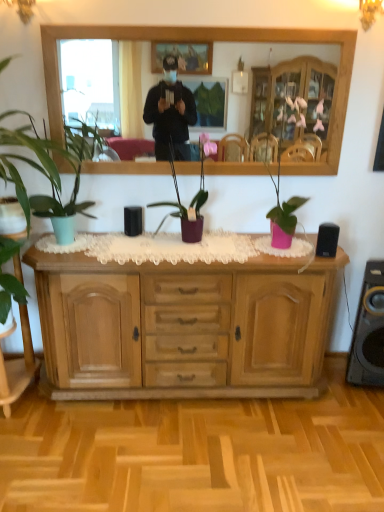
You are a GUI agent. You are given a task and a screenshot of the screen. Output one action in this format:
    pyautogui.click(x=<x>, y=<y>)
    Task: Click on the matte green plant at left, the 2th houseplant in the left-to-right sequence
    This screenshot has width=384, height=512.
    Given the screenshot: What is the action you would take?
    pyautogui.click(x=46, y=168)

What is the approximate width of black matte speaker at right?

10.34 centimeters.

Locate an element on the screen. This screenshot has width=384, height=512. matte purple pot at center, which is the 1th houseplant from right to left is located at coordinates (191, 200).

The height and width of the screenshot is (512, 384). Find the location of `light brown wood cabinet at center`. light brown wood cabinet at center is located at coordinates (183, 327).

From the image's perspective, starting from the matte purple pot at center, which is the 1th houseplant from right to left, which houseplant is the 1st one above? Please provide its 2D coordinates.

[(46, 168)]

Consider the image. Are matte green plant at left, the second houseplant when ordered from right to left, and matte purple pot at center, which is the 1th houseplant from right to left, beside each other?

No, matte green plant at left, the second houseplant when ordered from right to left, is not in contact with matte purple pot at center, which is the 1th houseplant from right to left.

Could you tell me if matte green plant at left, the 2th houseplant in the left-to-right sequence, is turned towards matte purple pot at center, which is the third houseplant in left-to-right order?

No, matte green plant at left, the 2th houseplant in the left-to-right sequence, does not turn towards matte purple pot at center, which is the third houseplant in left-to-right order.

In terms of width, does matte green plant at left, the 2th houseplant in the left-to-right sequence, look wider or thinner when compared to matte purple pot at center, which is the 1th houseplant from right to left?

Considering their sizes, matte green plant at left, the 2th houseplant in the left-to-right sequence, looks broader than matte purple pot at center, which is the 1th houseplant from right to left.

Is point (336, 234) positioned in front of point (86, 145)?

That is True.

Based on the photo, considering the sizes of objects black matte speaker at right and matte green plant at left, the second houseplant when ordered from right to left, in the image provided, who is smaller, black matte speaker at right or matte green plant at left, the second houseplant when ordered from right to left,?

black matte speaker at right.

Between black matte speaker at right and matte green plant at left, the second houseplant when ordered from right to left, which one appears on the left side from the viewer's perspective?

matte green plant at left, the second houseplant when ordered from right to left, is more to the left.

Between wooden mirror at upper center and black matte speaker at right, which one has larger width?

black matte speaker at right.

Considering the positions of point (327, 47) and point (333, 225), is point (327, 47) closer or farther from the camera than point (333, 225)?

Point (327, 47) is farther from the camera than point (333, 225).

Would you say wooden mirror at upper center contains black matte speaker at right?

Actually, black matte speaker at right is outside wooden mirror at upper center.

From a real-world perspective, which houseplant is the 1st one above the black glossy speaker at right? Please provide its 2D coordinates.

[(191, 200)]

Does matte purple pot at center, which is the third houseplant in left-to-right order, lie in front of black glossy speaker at right?

Yes, it is.

Which is more to the right, matte purple pot at center, which is the third houseplant in left-to-right order, or black glossy speaker at right?

black glossy speaker at right.

From the image's perspective, is matte purple pot at center, which is the third houseplant in left-to-right order, beneath black glossy speaker at right?

Actually, matte purple pot at center, which is the third houseplant in left-to-right order, appears above black glossy speaker at right in the image.

Are green matte plant at left, positioned as the first houseplant in left-to-right order, and light brown wood cabinet at center making contact?

No, green matte plant at left, positioned as the first houseplant in left-to-right order, is not with light brown wood cabinet at center.

Is point (6, 155) closer to viewer compared to point (252, 331)?

Yes, it is.

From a real-world perspective, is green matte plant at left, acting as the third houseplant starting from the right, physically below light brown wood cabinet at center?

No, from a real-world perspective, green matte plant at left, acting as the third houseplant starting from the right, is not under light brown wood cabinet at center.

Between green matte plant at left, positioned as the first houseplant in left-to-right order, and light brown wood cabinet at center, which one has smaller width?

With smaller width is light brown wood cabinet at center.

Where is `cabinetry on the right of matte green plant at left, the second houseplant when ordered from right to left`? cabinetry on the right of matte green plant at left, the second houseplant when ordered from right to left is located at coordinates tap(183, 327).

From the image's perspective, is light brown wood cabinet at center over matte green plant at left, the 2th houseplant in the left-to-right sequence?

No, from the image's perspective, light brown wood cabinet at center is not above matte green plant at left, the 2th houseplant in the left-to-right sequence.

In the image, is light brown wood cabinet at center positioned in front of or behind matte green plant at left, the second houseplant when ordered from right to left?

Clearly, light brown wood cabinet at center is behind matte green plant at left, the second houseplant when ordered from right to left.

From a real-world perspective, which is physically above, light brown wood cabinet at center or matte green plant at left, the 2th houseplant in the left-to-right sequence?

From a 3D spatial view, matte green plant at left, the 2th houseplant in the left-to-right sequence, is above.

Visually, is light brown wood cabinet at center positioned to the left or to the right of black glossy speaker at right?

Based on their positions, light brown wood cabinet at center is located to the left of black glossy speaker at right.

Looking at this image, how much distance is there between light brown wood cabinet at center and black glossy speaker at right?

76.54 centimeters.

Are light brown wood cabinet at center and black glossy speaker at right beside each other?

No, light brown wood cabinet at center is not making contact with black glossy speaker at right.

Is light brown wood cabinet at center in front of black glossy speaker at right?

Yes.

There is a matte purple pot at center, which is the third houseplant in left-to-right order. Where is `the 1st houseplant above it (from a real-world perspective)`? This screenshot has width=384, height=512. the 1st houseplant above it (from a real-world perspective) is located at coordinates (46, 168).

This screenshot has width=384, height=512. In order to click on speaker located below the matte green plant at left, the 2th houseplant in the left-to-right sequence (from the image's perspective) in this screenshot , I will do `click(327, 240)`.

From the image, which object appears to be nearer to wooden mirror at upper center, matte purple pot at center, which is the 1th houseplant from right to left, or green matte plant at left, acting as the third houseplant starting from the right?

matte purple pot at center, which is the 1th houseplant from right to left, is closer to wooden mirror at upper center.

Considering their positions, is light brown wood cabinet at center positioned further to green matte plant at left, acting as the third houseplant starting from the right, than matte green plant at left, the second houseplant when ordered from right to left?

Based on the image, light brown wood cabinet at center appears to be further to green matte plant at left, acting as the third houseplant starting from the right.

Looking at the image, which one is located further to black glossy speaker at right, wooden mirror at upper center or black matte speaker at right?

The object further to black glossy speaker at right is wooden mirror at upper center.

Estimate the real-world distances between objects in this image. Which object is further from light brown wood cabinet at center, green matte plant at left, acting as the third houseplant starting from the right, or black glossy speaker at right?

black glossy speaker at right.

From the image, which object appears to be farther from black matte speaker at right, light brown wood cabinet at center or matte green plant at left, the second houseplant when ordered from right to left?

matte green plant at left, the second houseplant when ordered from right to left, lies further to black matte speaker at right than the other object.

In the scene shown: When comparing their distances from light brown wood cabinet at center, does black matte speaker at right or matte green plant at left, the second houseplant when ordered from right to left, seem further?

black matte speaker at right.

When comparing their distances from black glossy speaker at right, does light brown wood cabinet at center or matte green plant at left, the second houseplant when ordered from right to left, seem further?

matte green plant at left, the second houseplant when ordered from right to left, is positioned further to the anchor black glossy speaker at right.

From the picture: When comparing their distances from wooden mirror at upper center, does matte green plant at left, the second houseplant when ordered from right to left, or green matte plant at left, acting as the third houseplant starting from the right, seem closer?

matte green plant at left, the second houseplant when ordered from right to left.

The width and height of the screenshot is (384, 512). In order to click on houseplant between matte green plant at left, the second houseplant when ordered from right to left, and light brown wood cabinet at center vertically in this screenshot , I will do `click(191, 200)`.

This screenshot has width=384, height=512. Find the location of `mirror situated between matte purple pot at center, which is the third houseplant in left-to-right order, and black matte speaker at right from left to right`. mirror situated between matte purple pot at center, which is the third houseplant in left-to-right order, and black matte speaker at right from left to right is located at coordinates (259, 65).

Locate an element on the screen. Image resolution: width=384 pixels, height=512 pixels. cabinetry between matte purple pot at center, which is the 1th houseplant from right to left, and black matte speaker at right from left to right is located at coordinates (183, 327).

At what (x,y) coordinates should I click in order to perform the action: click on speaker between matte purple pot at center, which is the 1th houseplant from right to left, and black glossy speaker at right. Please return your answer as a coordinate pair (x, y). Image resolution: width=384 pixels, height=512 pixels. Looking at the image, I should click on (x=327, y=240).